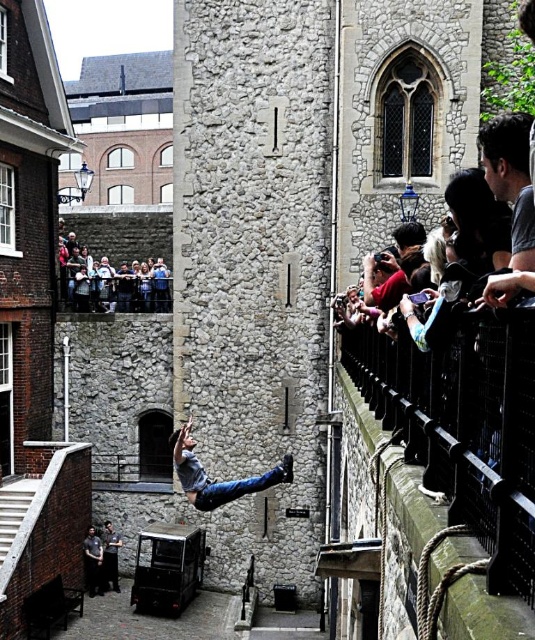
Question: Which of the following is the farthest from the observer?

Choices:
 (A) (87, 224)
 (B) (109, 568)
 (C) (101, 588)

Answer: (A)

Question: Which point is farther from the camera taking this photo?

Choices:
 (A) (104, 573)
 (B) (281, 461)

Answer: (B)

Question: Which object appears closest to the camera in this image?

Choices:
 (A) dark gray uniform at center
 (B) dark blue jeans at lower center
 (C) gray fabric shirt at center

Answer: (C)

Question: Observing the image, what is the correct spatial positioning of gray fabric shirt at center in reference to dark blue jeans at lower center?

Choices:
 (A) right
 (B) left

Answer: (A)

Question: Considering the relative positions of gray fabric shirt at center and dark gray uniform at center in the image provided, where is gray fabric shirt at center located with respect to dark gray uniform at center?

Choices:
 (A) left
 (B) right

Answer: (B)

Question: Can you confirm if dark blue jeans at lower center is positioned above dark gray uniform at center?

Choices:
 (A) no
 (B) yes

Answer: (B)